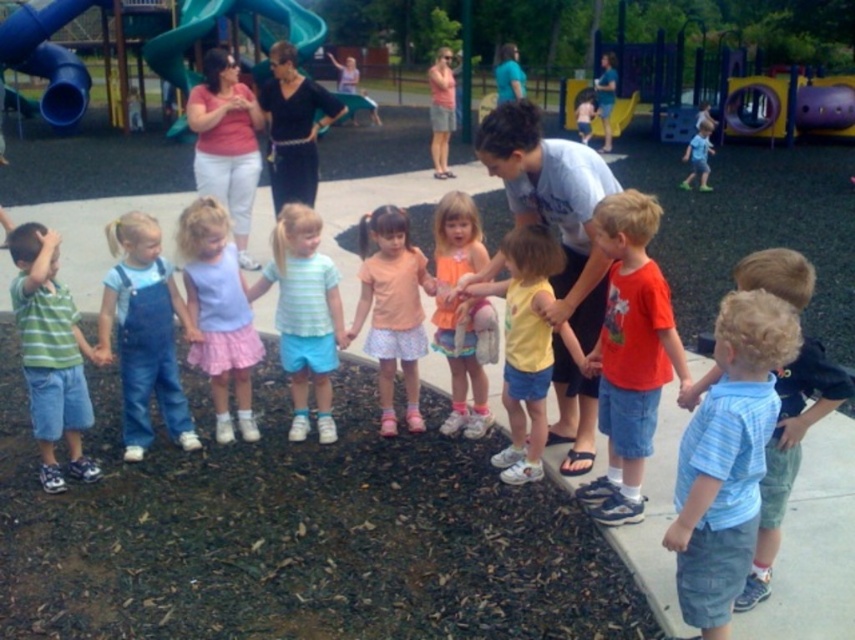
You are a photographer positioned at the center of the playground. You want to capture a photo of the blue striped shirt at center. According to the coordinates provided, in which direction should you aim your camera relative to your position?

The blue striped shirt at center is located at coordinates point [727,458]. Since the photographer is at the center, aiming towards the upper right direction would capture the blue striped shirt at center as it is positioned at those coordinates.

You are a parent at the playground. Your child is wearing blue denim shorts at center and wants to climb the smooth blue slide at upper left. Considering the height difference between the two, do you think your child will be able to reach the top of the slide easily?

The smooth blue slide at upper left is taller than the blue denim shorts at center, so the child may need assistance to reach the top of the slide since the slide is higher.